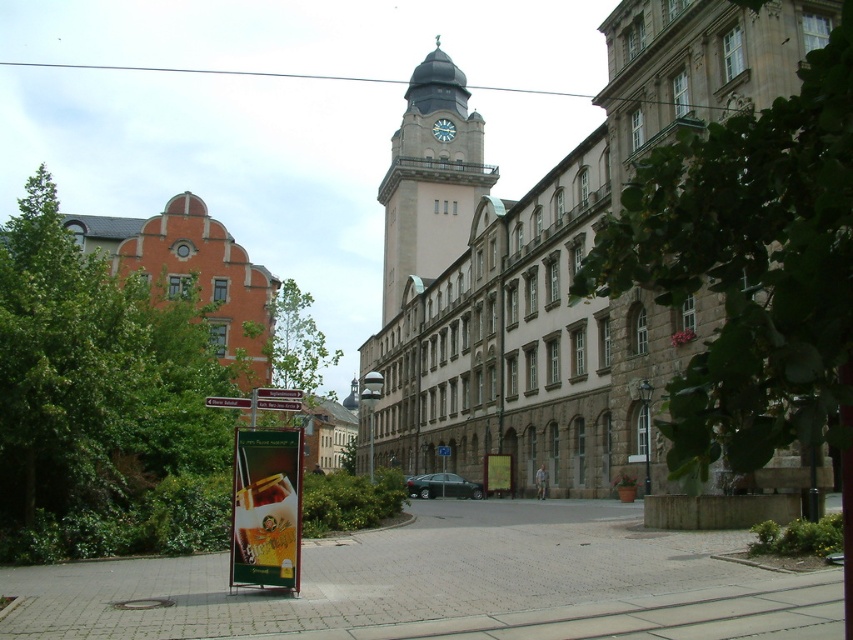
You are a photographer standing at the camera position in the scene. You want to capture the green leafy tree at left in your shot. What is the approximate distance you need to maintain from the tree to frame it properly?

The green leafy tree at left is approximately 52.07 meters away from the camera position, so you need to maintain a distance of around 52.07 meters to frame it properly.

You are a city planner assessing the distance between landmarks for a new walking path. Given the green leafy tree at left and the smooth stone clock tower at center, which object is farther from the other?

The green leafy tree at left is 302.46 feet away from the smooth stone clock tower at center, so the tree is farther away from the clock tower than the clock tower is from the tree.

You are a city planner assessing the urban layout. You need to determine which object occupies more space in the scene between the green leafy tree at left and the smooth stone clock tower at center. Based on the scene description, which one is bigger?

The green leafy tree at left is larger in size than the smooth stone clock tower at center, so the green leafy tree at left occupies more space in the scene.